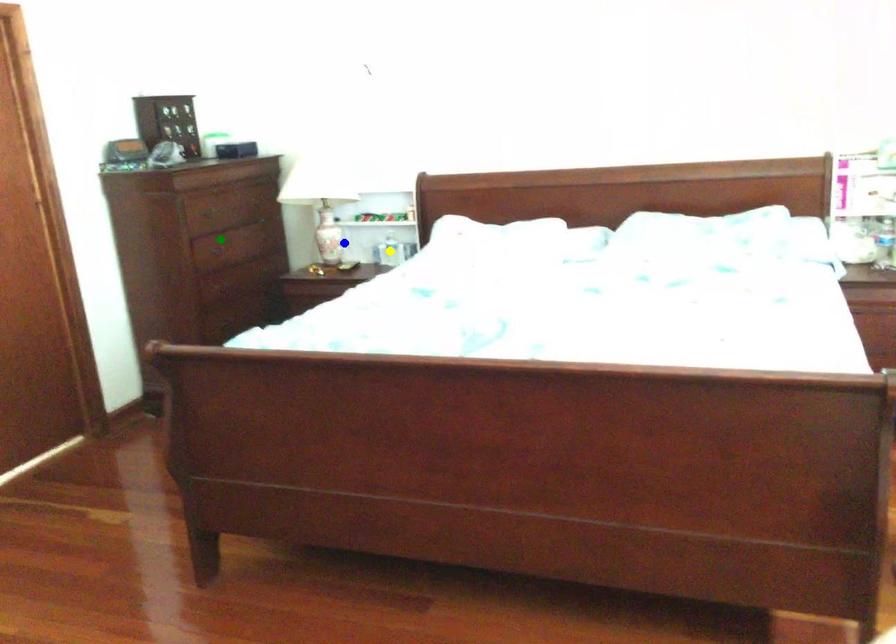
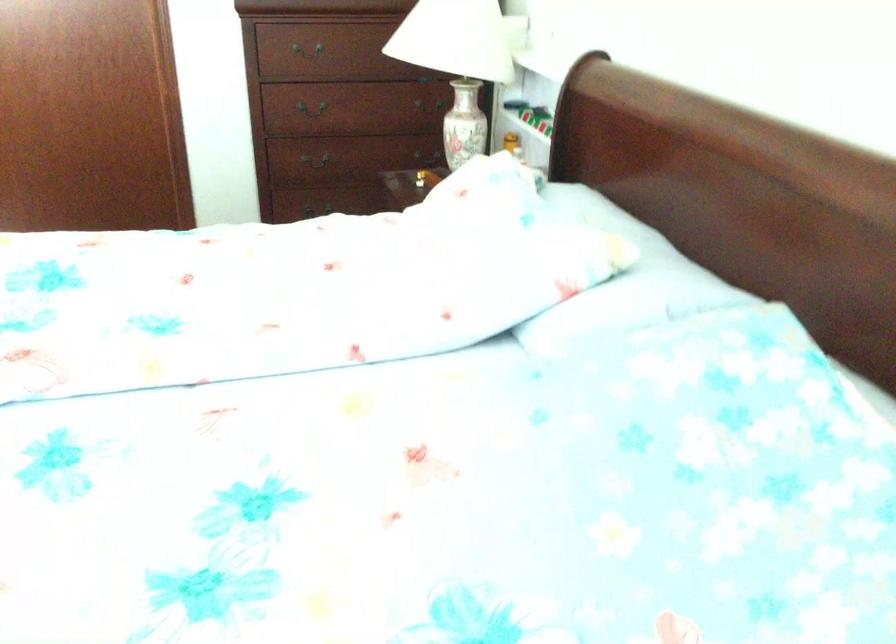
I am providing you with two images of the same scene from different viewpoints. Three points are marked in image1. Which point corresponds to a part or object that is occluded in image2?In image1, three points are marked. Which of them correspond to a part or object that is occluded in image2?Among the three points shown in image1, which one corresponds to a part or object that is no longer visible due to occlusion in image2?

Invisible in image2: yellow point.